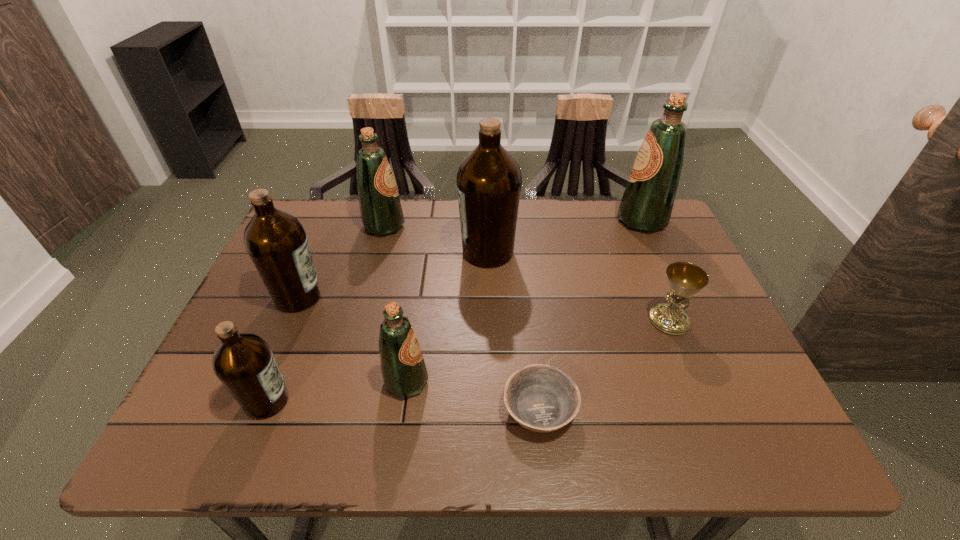
I want to click on the third closest green olive oil to the smallest brown olive oil, so click(x=647, y=202).

Locate an element on the screen. The image size is (960, 540). green olive oil that is the second closest to the biggest brown olive oil is located at coordinates (404, 372).

You are a GUI agent. You are given a task and a screenshot of the screen. Output one action in this format:
    pyautogui.click(x=<x>, y=<y>)
    Task: Click on the free space that satisfies the following two spatial constraints: 1. on the back side of the shortest object; 2. on the front-facing side of the second green olive oil from right to left
    
    Given the screenshot: What is the action you would take?
    pyautogui.click(x=537, y=381)

At what (x,y) coordinates should I click in order to perform the action: click on free space that satisfies the following two spatial constraints: 1. on the back side of the shortest object; 2. on the front-facing side of the third olive oil from left to right. Please return your answer as a coordinate pair (x, y). Looking at the image, I should click on (519, 226).

What are the coordinates of `free space that satisfies the following two spatial constraints: 1. on the front-facing side of the smallest green olive oil; 2. on the back side of the shortest object` in the screenshot? It's located at (402, 409).

The width and height of the screenshot is (960, 540). I want to click on vacant area that satisfies the following two spatial constraints: 1. on the label of the rightmost brown olive oil; 2. on the left side of the shortest object, so click(492, 409).

Identify the location of free spot that satisfies the following two spatial constraints: 1. on the front-facing side of the fourth object from left to right; 2. on the back side of the bowl. (402, 409).

Where is `free space that satisfies the following two spatial constraints: 1. on the label of the shortest object; 2. on the right side of the second farthest brown olive oil`? The image size is (960, 540). free space that satisfies the following two spatial constraints: 1. on the label of the shortest object; 2. on the right side of the second farthest brown olive oil is located at coordinates (252, 409).

Locate an element on the screen. The width and height of the screenshot is (960, 540). free space that satisfies the following two spatial constraints: 1. on the front-facing side of the third object from left to right; 2. on the left side of the shortest object is located at coordinates (335, 409).

Find the location of a particular element. The width and height of the screenshot is (960, 540). vacant region that satisfies the following two spatial constraints: 1. on the back side of the shortest object; 2. on the label of the farthest brown olive oil is located at coordinates (522, 252).